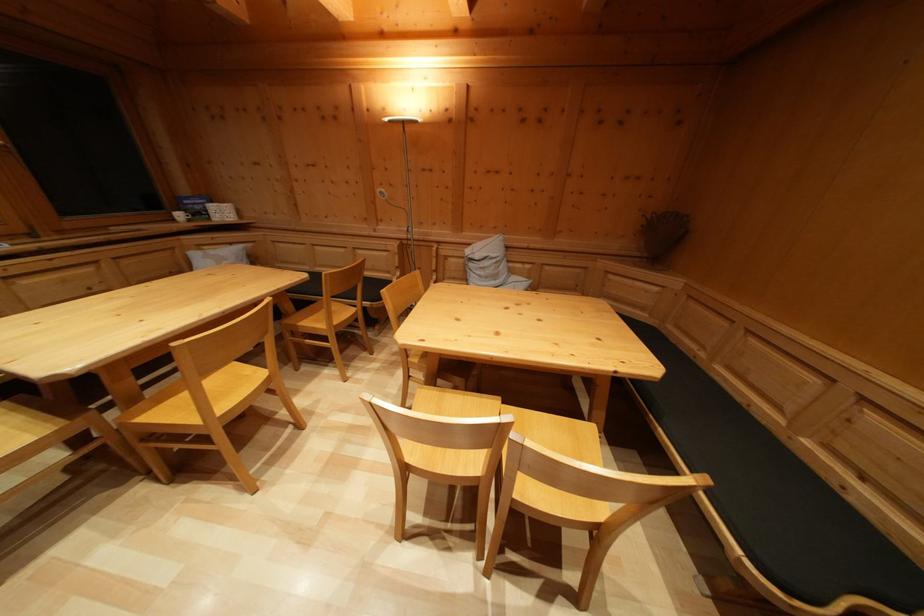
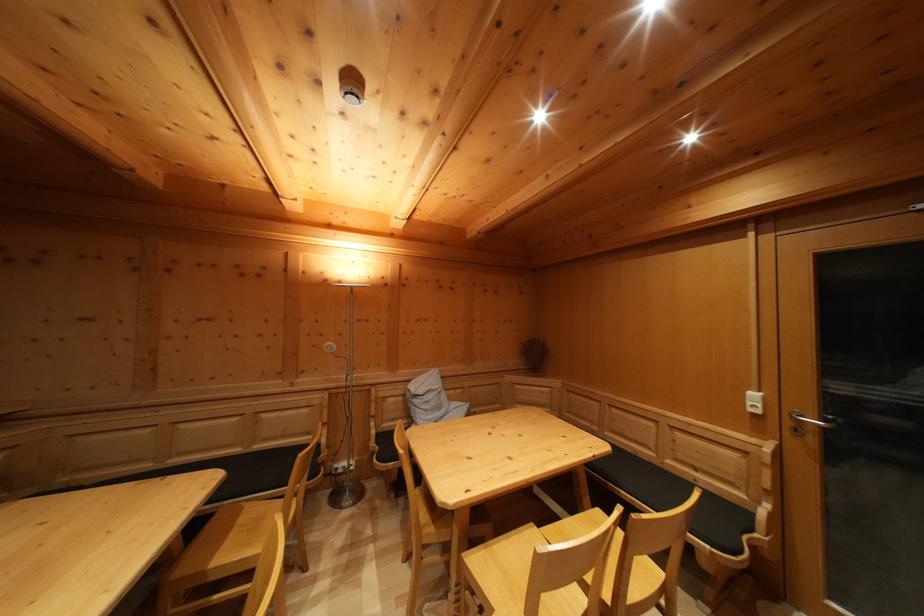
How did the camera likely rotate?

The rotation direction of the camera is right-up.